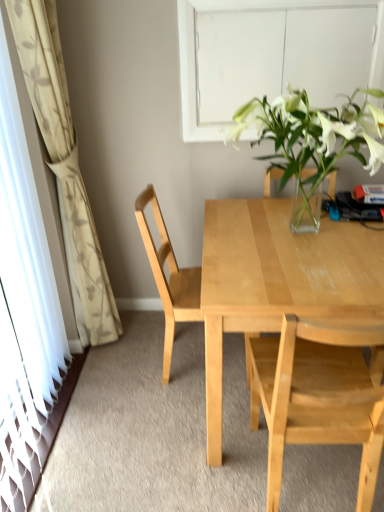
Question: Would you consider light wood chair at center, placed as the first chair when sorted from front to back, to be distant from light wood chair at center, the 2th chair positioned from the front?

Choices:
 (A) no
 (B) yes

Answer: (A)

Question: Can you confirm if light wood chair at center, placed as the first chair when sorted from front to back, is wider than light wood chair at center, the 2th chair positioned from the front?

Choices:
 (A) no
 (B) yes

Answer: (A)

Question: Does light wood chair at center, which is counted as the second chair, starting from the back, have a lesser width compared to light wood chair at center, the 2th chair positioned from the front?

Choices:
 (A) no
 (B) yes

Answer: (B)

Question: Is light wood chair at center, which is counted as the second chair, starting from the back, taller than light wood chair at center, the 2th chair positioned from the front?

Choices:
 (A) yes
 (B) no

Answer: (B)

Question: Is light wood chair at center, the 2th chair positioned from the front, located within light wood chair at center, which is counted as the second chair, starting from the back?

Choices:
 (A) no
 (B) yes

Answer: (A)

Question: From a real-world perspective, is white floral-patterned curtain at left above or below light wood chair at center, the 2th chair positioned from the front?

Choices:
 (A) above
 (B) below

Answer: (A)

Question: Based on their positions, is white floral-patterned curtain at left located to the left or right of light wood chair at center, the 2th chair positioned from the front?

Choices:
 (A) right
 (B) left

Answer: (B)

Question: Considering the positions of white floral-patterned curtain at left and light wood chair at center, the 2th chair positioned from the front, in the image, is white floral-patterned curtain at left taller or shorter than light wood chair at center, the 2th chair positioned from the front,?

Choices:
 (A) short
 (B) tall

Answer: (B)

Question: Which is correct: white floral-patterned curtain at left is inside light wood chair at center, marked as the first chair in a back-to-front arrangement, or outside of it?

Choices:
 (A) outside
 (B) inside

Answer: (A)

Question: Which is correct: transparent glass door at left is inside light wood desk at center, or outside of it?

Choices:
 (A) outside
 (B) inside

Answer: (A)

Question: Considering the positions of transparent glass door at left and light wood desk at center in the image, is transparent glass door at left wider or thinner than light wood desk at center?

Choices:
 (A) wide
 (B) thin

Answer: (B)

Question: In the image, is transparent glass door at left positioned in front of or behind light wood desk at center?

Choices:
 (A) behind
 (B) front

Answer: (B)

Question: From the image's perspective, is transparent glass door at left located above or below light wood desk at center?

Choices:
 (A) above
 (B) below

Answer: (A)

Question: From a real-world perspective, relative to white matte window at upper center, is white floral-patterned curtain at left vertically above or below?

Choices:
 (A) above
 (B) below

Answer: (B)

Question: Based on their sizes in the image, would you say white floral-patterned curtain at left is bigger or smaller than white matte window at upper center?

Choices:
 (A) big
 (B) small

Answer: (A)